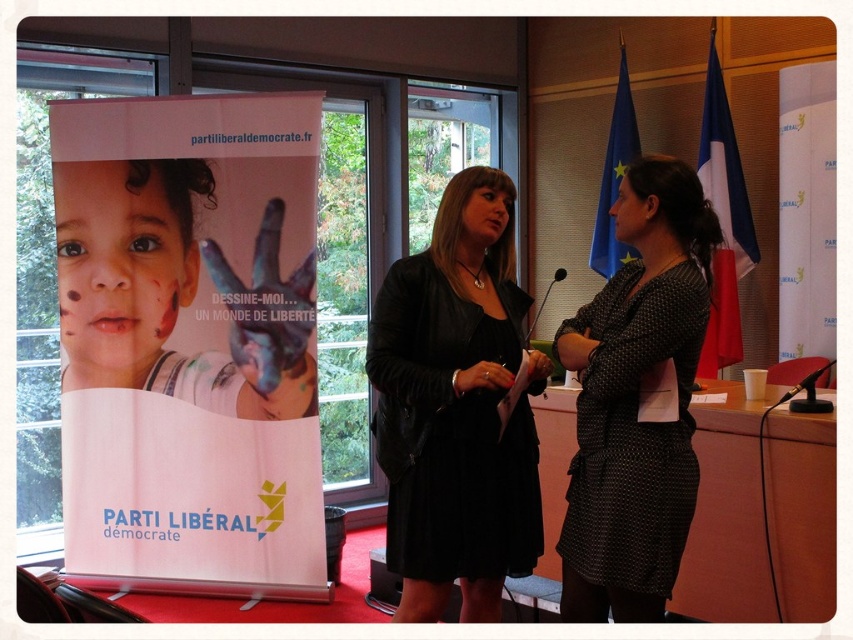
Which is behind, point (102, 428) or point (433, 516)?

The point (102, 428) is more distant.

Where is `white paper poster at left`? The height and width of the screenshot is (640, 853). white paper poster at left is located at coordinates (189, 340).

Does white paper poster at left have a greater height compared to blue fabric flag at upper right?

Indeed, white paper poster at left has a greater height compared to blue fabric flag at upper right.

Which is in front, point (157, 468) or point (614, 100)?

Positioned in front is point (157, 468).

At what (x,y) coordinates should I click in order to perform the action: click on white paper poster at left. Please return your answer as a coordinate pair (x, y). The height and width of the screenshot is (640, 853). Looking at the image, I should click on (189, 340).

Who is lower down, white paper poster at left or polka dot dress at center?

polka dot dress at center is below.

Is white paper poster at left positioned before polka dot dress at center?

No, it is behind polka dot dress at center.

Measure the distance between point (219, 458) and camera.

The distance of point (219, 458) from camera is 11.60 feet.

Locate an element on the screen. The height and width of the screenshot is (640, 853). white paper poster at left is located at coordinates (189, 340).